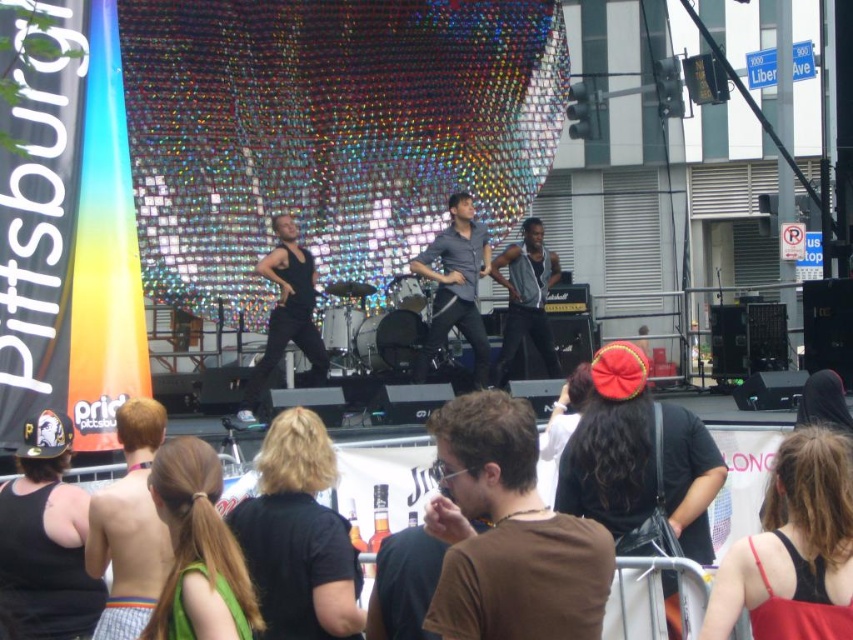
Question: Which object appears farthest from the camera in this image?

Choices:
 (A) metallic silver vest at center
 (B) skinny jeans at lower left

Answer: (A)

Question: Does skinny jeans at lower left appear under metallic silver vest at center?

Choices:
 (A) yes
 (B) no

Answer: (A)

Question: Among these objects, which one is farthest from the camera?

Choices:
 (A) brown matte shirt at center
 (B) metallic silver vest at center

Answer: (B)

Question: Observing the image, what is the correct spatial positioning of brown matte shirt at center in reference to black matte tank top at center?

Choices:
 (A) left
 (B) right

Answer: (B)

Question: Observing the image, what is the correct spatial positioning of skinny jeans at lower left in reference to black matte tank top at center?

Choices:
 (A) right
 (B) left

Answer: (B)

Question: Which point is farther to the camera?

Choices:
 (A) matte gray shirt at center
 (B) skinny jeans at lower left

Answer: (A)